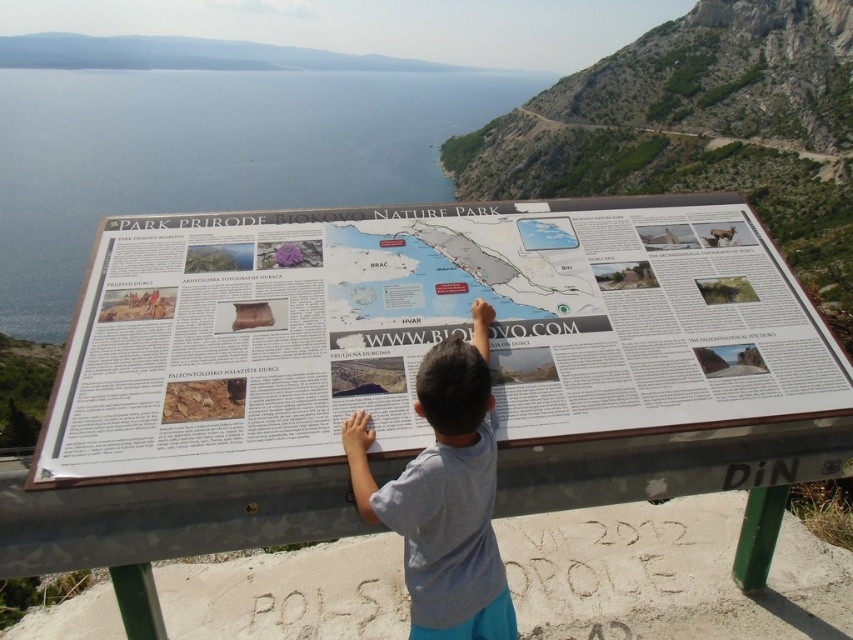
Which is more to the right, white plastic map at center or gray cotton shirt at center?

white plastic map at center

Is white plastic map at center positioned in front of gray cotton shirt at center?

Yes, white plastic map at center is in front of gray cotton shirt at center.

Between point (561, 408) and point (462, 435), which one is positioned behind?

The point (462, 435) is more distant.

I want to click on white plastic map at center, so click(x=425, y=330).